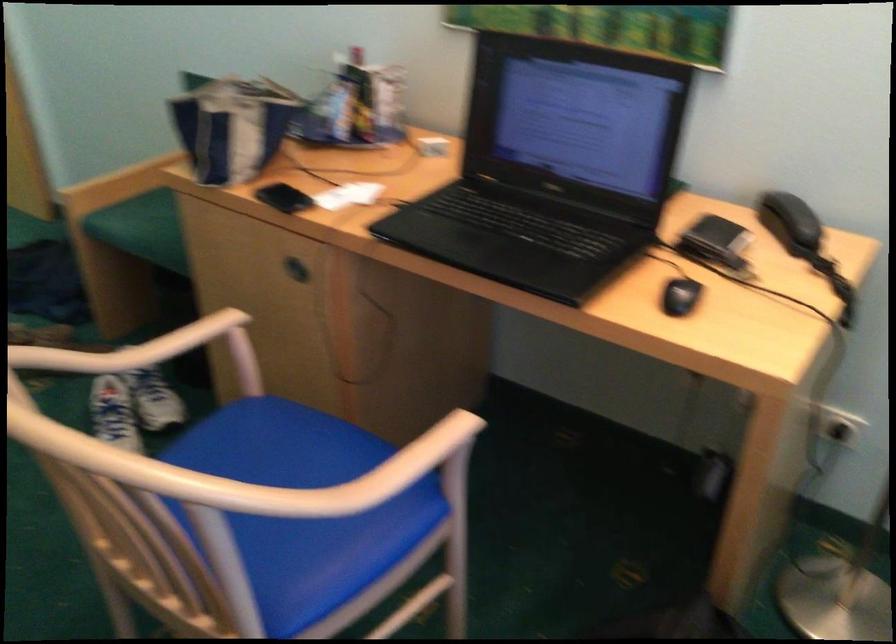
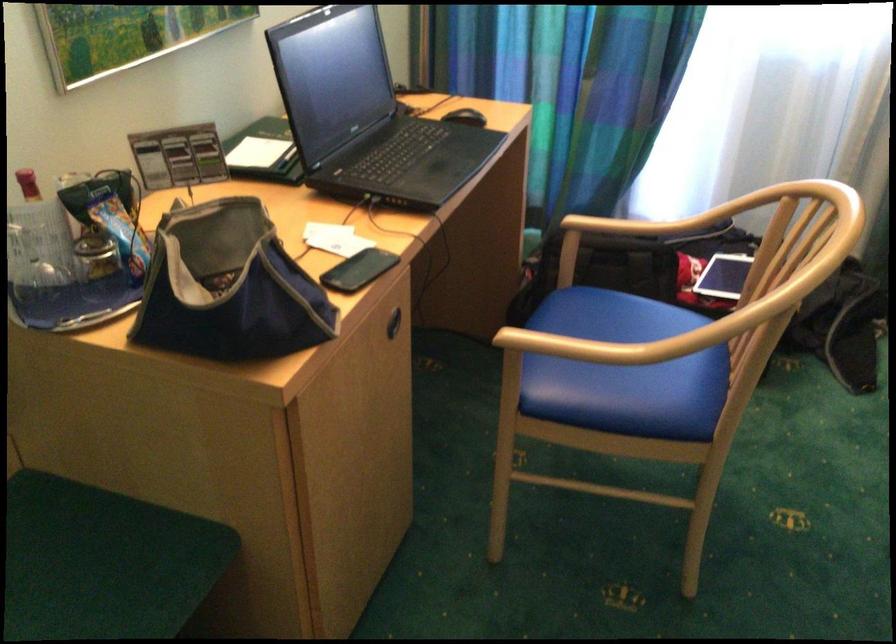
The point at (200,111) is marked in the first image. Where is the corresponding point in the second image?

(228, 287)